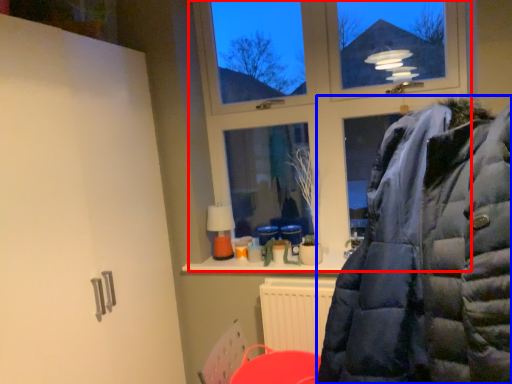
Question: Among these objects, which one is nearest to the camera, window (highlighted by a red box) or jacket (highlighted by a blue box)?

Choices:
 (A) window
 (B) jacket

Answer: (B)